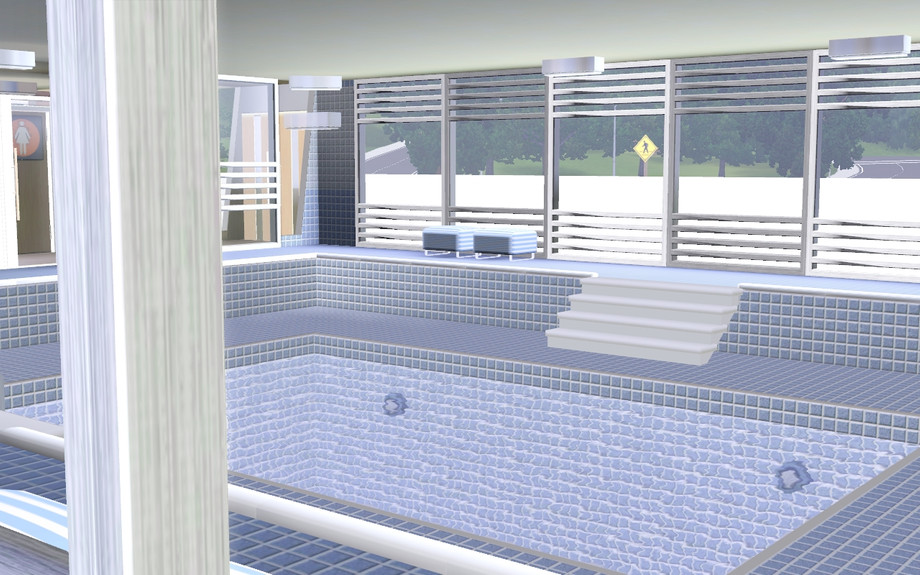
Locate an element on the screen. This screenshot has width=920, height=575. door to outside is located at coordinates (286, 208).